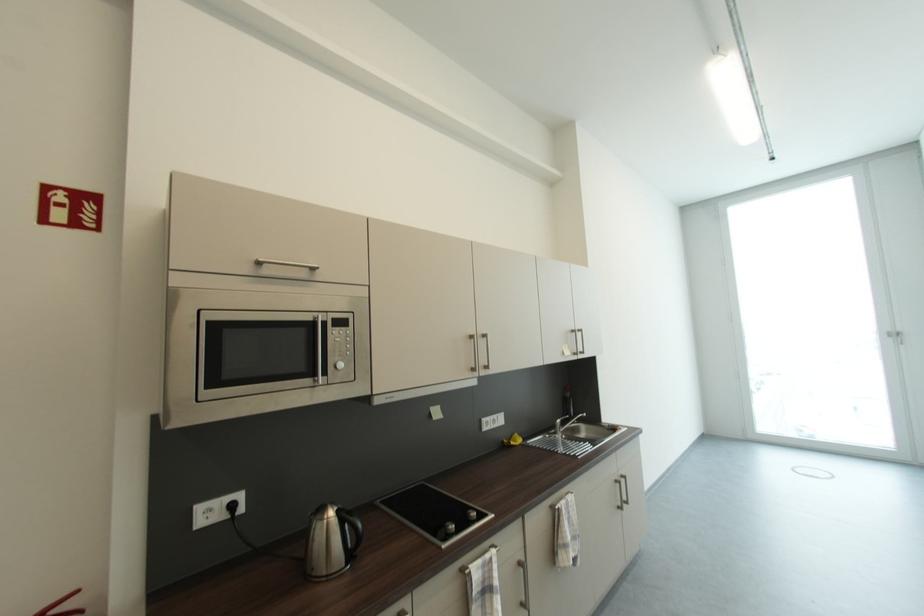
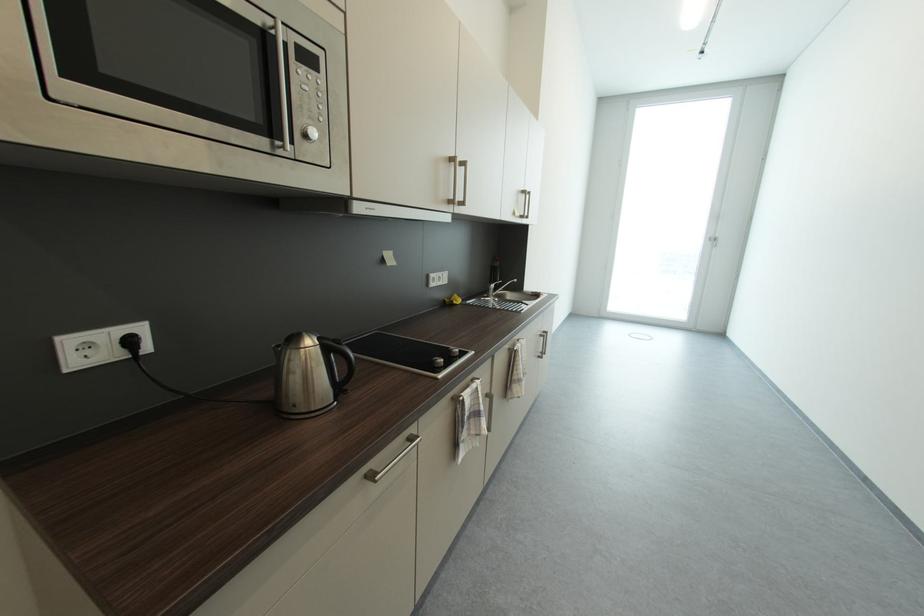
The point at (238,508) is marked in the first image. Where is the corresponding point in the second image?

(137, 344)